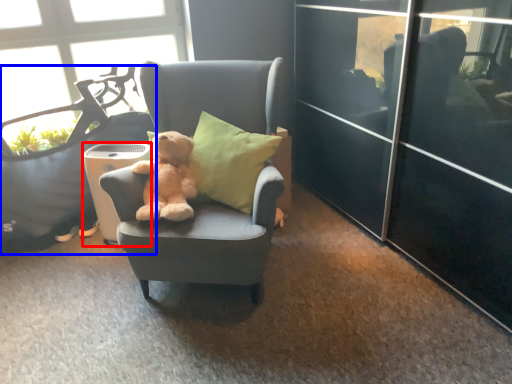
Question: Which point is further to the camera, trash bin/can (highlighted by a red box) or chair (highlighted by a blue box)?

Choices:
 (A) trash bin/can
 (B) chair

Answer: (A)